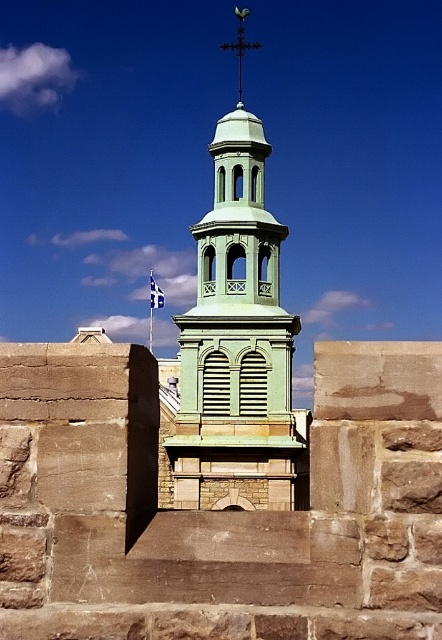
You are a drone operator tasked with capturing aerial footage of the green matte tower at center and the black metal cross at upper center. Your drone has a maximum range of 60 feet. Can you fly the drone from the tower to the cross without exceeding the maximum range?

The green matte tower at center is 60.40 feet away from the black metal cross at upper center. Since the distance is slightly over the drone maximum range of 60 feet, the drone cannot reach the cross from the tower without exceeding its range.

You are standing in front of the historic stone structure and want to determine the relative positions of two specific points marked on the wall. Which of the two points, point 1 at coordinates point (195,330) or point 2 at coordinates point (240,40), is closer to you?

Point 1 at coordinates point (195,330) is closer to you because it is in front of point 2 at coordinates point (240,40).

You are standing in front of the historic stone structure and notice two landmarks. Which one is positioned to the left when looking at the green matte tower at center and the black metal cross at upper center?

The green matte tower at center is positioned to the left of the black metal cross at upper center.